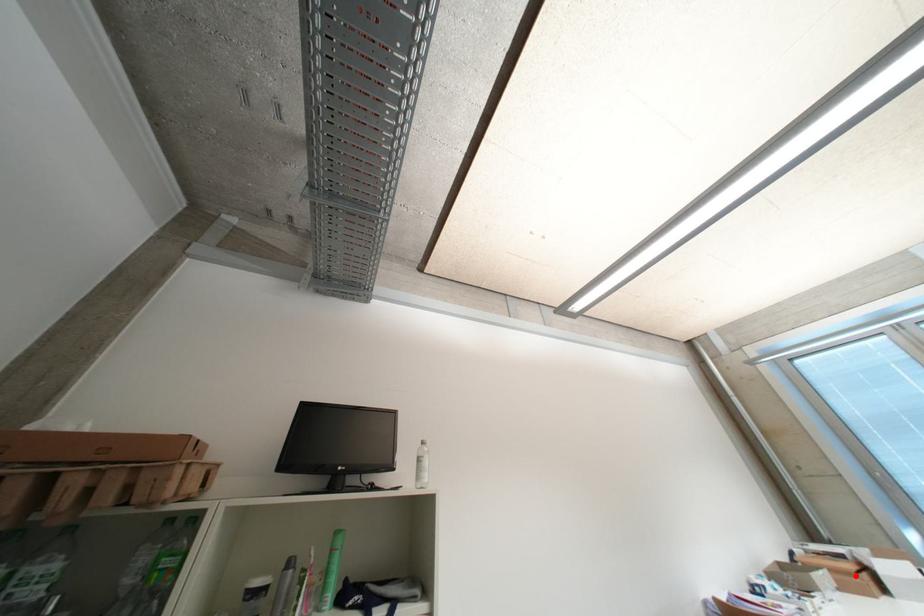
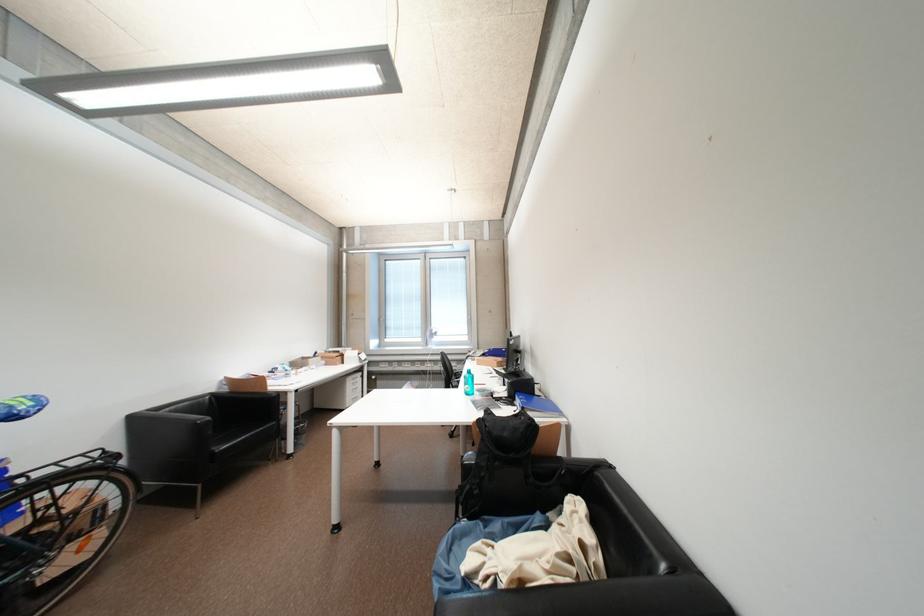
Question: I am providing you with two images of the same scene from different viewpoints. A red point is marked on the first image. Can you still see the location of the red point in image 2?

Choices:
 (A) Yes
 (B) No

Answer: (A)